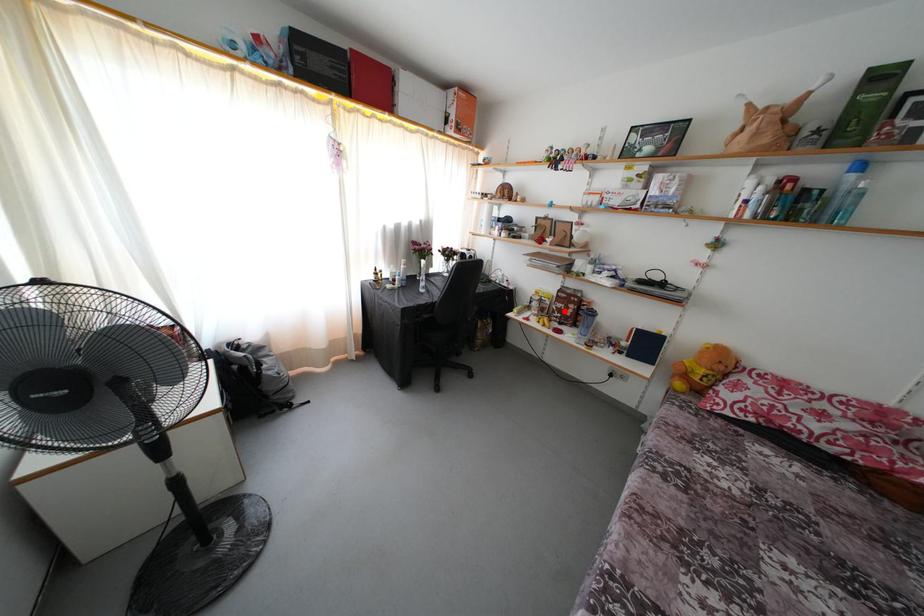
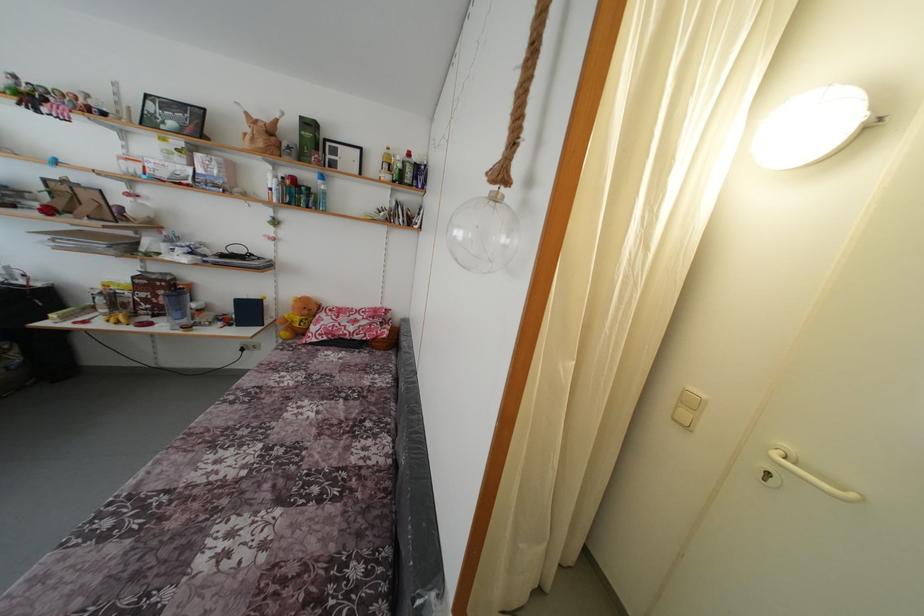
Question: I am providing you with two images of the same scene from different viewpoints. Image1 has a red point marked. In image2, the corresponding 3D location appears at what relative position? Reply with the corresponding letter.

Choices:
 (A) Closer
 (B) Farther

Answer: (B)